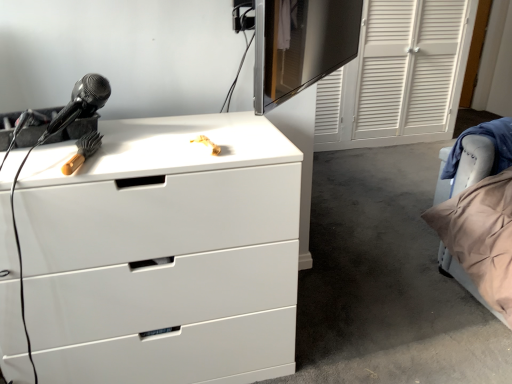
Question: Is the depth of black glossy monitor at upper center greater than that of white glossy chest of drawers at upper left?

Choices:
 (A) yes
 (B) no

Answer: (B)

Question: Can you confirm if black glossy monitor at upper center is bigger than white glossy chest of drawers at upper left?

Choices:
 (A) no
 (B) yes

Answer: (A)

Question: Is black glossy monitor at upper center aimed at white glossy chest of drawers at upper left?

Choices:
 (A) no
 (B) yes

Answer: (A)

Question: From a real-world perspective, is black glossy monitor at upper center positioned under white glossy chest of drawers at upper left based on gravity?

Choices:
 (A) no
 (B) yes

Answer: (A)

Question: Is black glossy monitor at upper center not near white glossy chest of drawers at upper left?

Choices:
 (A) no
 (B) yes

Answer: (B)

Question: From the image's perspective, is white glossy chest of drawers at upper left positioned above or below black glossy monitor at upper center?

Choices:
 (A) above
 (B) below

Answer: (B)

Question: Is white glossy chest of drawers at upper left wider or thinner than black glossy monitor at upper center?

Choices:
 (A) thin
 (B) wide

Answer: (B)

Question: Is white glossy chest of drawers at upper left to the left or to the right of black glossy monitor at upper center in the image?

Choices:
 (A) right
 (B) left

Answer: (B)

Question: Looking at the image, does white glossy chest of drawers at upper left seem bigger or smaller compared to black glossy monitor at upper center?

Choices:
 (A) big
 (B) small

Answer: (A)

Question: Is velvet beige pillow at right bigger or smaller than black glossy monitor at upper center?

Choices:
 (A) small
 (B) big

Answer: (B)

Question: Considering the positions of velvet beige pillow at right and black glossy monitor at upper center in the image, is velvet beige pillow at right wider or thinner than black glossy monitor at upper center?

Choices:
 (A) thin
 (B) wide

Answer: (B)

Question: From the image's perspective, is velvet beige pillow at right located above or below black glossy monitor at upper center?

Choices:
 (A) above
 (B) below

Answer: (B)

Question: Would you say velvet beige pillow at right is to the left or to the right of black glossy monitor at upper center in the picture?

Choices:
 (A) left
 (B) right

Answer: (B)

Question: Do you think velvet beige pillow at right is within white glossy chest of drawers at upper left, or outside of it?

Choices:
 (A) inside
 (B) outside

Answer: (B)

Question: Considering the positions of velvet beige pillow at right and white glossy chest of drawers at upper left in the image, is velvet beige pillow at right bigger or smaller than white glossy chest of drawers at upper left?

Choices:
 (A) big
 (B) small

Answer: (B)